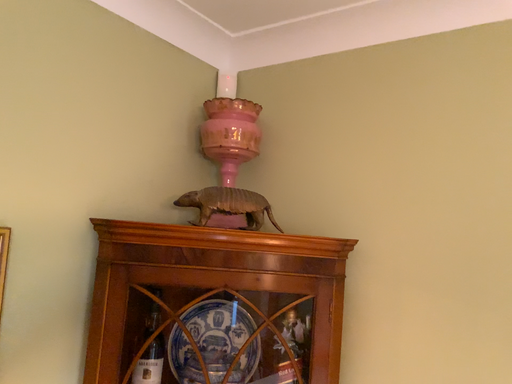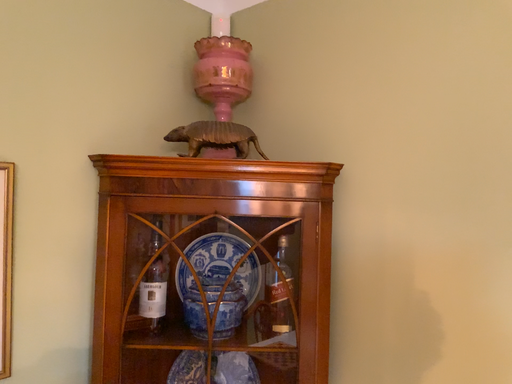
Question: How did the camera likely rotate when shooting the video?

Choices:
 (A) rotated right
 (B) rotated left

Answer: (B)